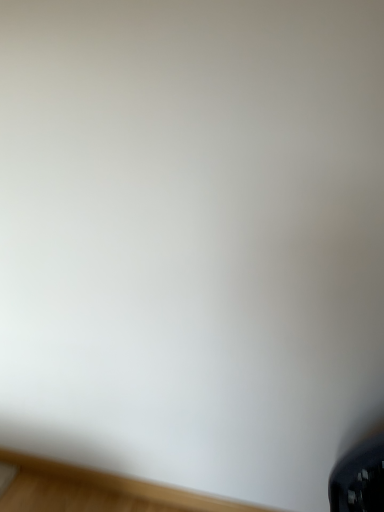
Locate an element on the screen. The height and width of the screenshot is (512, 384). wooden floor at lower left is located at coordinates (98, 490).

Describe the element at coordinates (98, 490) in the screenshot. This screenshot has width=384, height=512. I see `wooden floor at lower left` at that location.

You are a GUI agent. You are given a task and a screenshot of the screen. Output one action in this format:
    pyautogui.click(x=<x>, y=<y>)
    Task: Click on the wooden floor at lower left
    Image resolution: width=384 pixels, height=512 pixels.
    Given the screenshot: What is the action you would take?
    pyautogui.click(x=98, y=490)